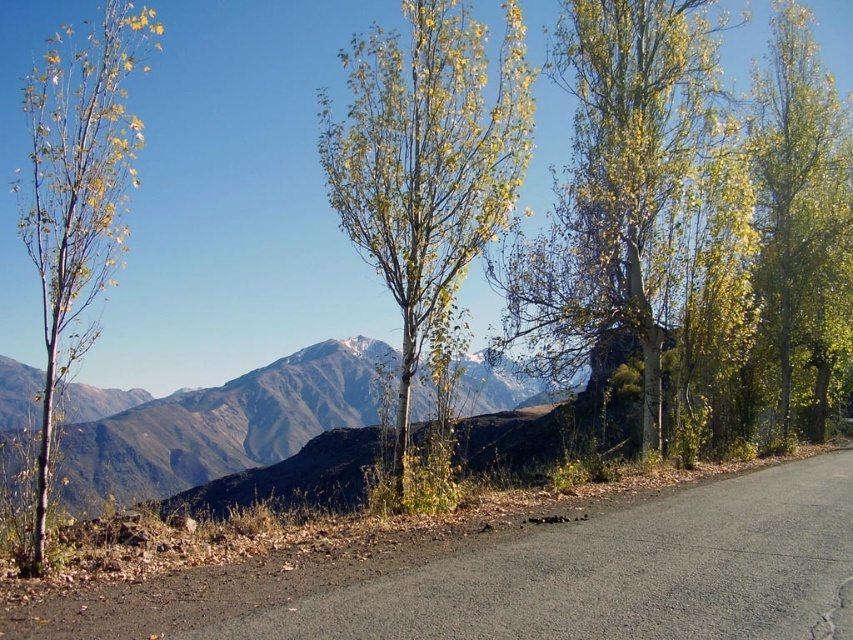
Question: Is green grassy mountain range at left positioned before yellow-green foliage at left?

Choices:
 (A) no
 (B) yes

Answer: (A)

Question: Does yellow-green foliage at upper right have a lesser width compared to green grassy mountain range at left?

Choices:
 (A) yes
 (B) no

Answer: (A)

Question: Which of these objects is positioned farthest from the green leafy tree at right?

Choices:
 (A) green grassy mountain range at left
 (B) yellow-green foliage at upper right
 (C) green matte birch tree at center
 (D) asphalt road at lower center

Answer: (A)

Question: Which object is farther from the camera taking this photo?

Choices:
 (A) yellow-green foliage at left
 (B) asphalt road at lower center

Answer: (A)

Question: Where is asphalt road at lower center located in relation to yellow-green foliage at left in the image?

Choices:
 (A) below
 (B) above

Answer: (A)

Question: Considering the real-world distances, which object is farthest from the green grassy mountain range at left?

Choices:
 (A) yellow-green foliage at upper right
 (B) green leafy tree at right

Answer: (B)